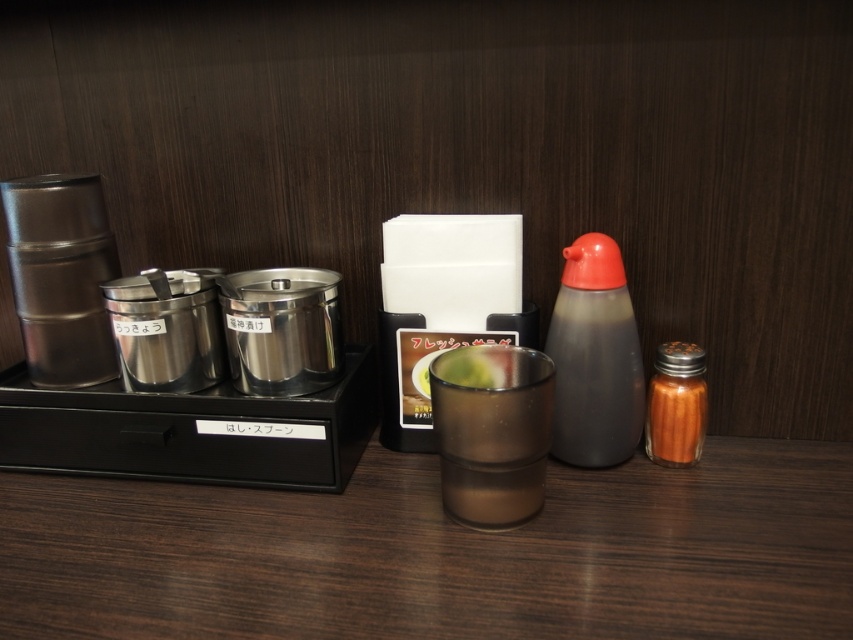
Question: Does translucent brown glass at center have a smaller size compared to orange glass spice shaker at right?

Choices:
 (A) no
 (B) yes

Answer: (A)

Question: Does translucent brown glass at center have a greater width compared to smokey gray plastic bottle at center-right?

Choices:
 (A) no
 (B) yes

Answer: (B)

Question: Is smokey gray plastic bottle at center-right above orange glass spice shaker at right?

Choices:
 (A) yes
 (B) no

Answer: (A)

Question: Which point is closer to the camera?

Choices:
 (A) (473, 422)
 (B) (608, 266)

Answer: (A)

Question: Which object is positioned farthest from the orange glass spice shaker at right?

Choices:
 (A) smokey gray plastic bottle at center-right
 (B) translucent brown glass at center

Answer: (B)

Question: Which of these objects is positioned farthest from the orange glass spice shaker at right?

Choices:
 (A) smokey gray plastic bottle at center-right
 (B) translucent brown glass at center

Answer: (B)